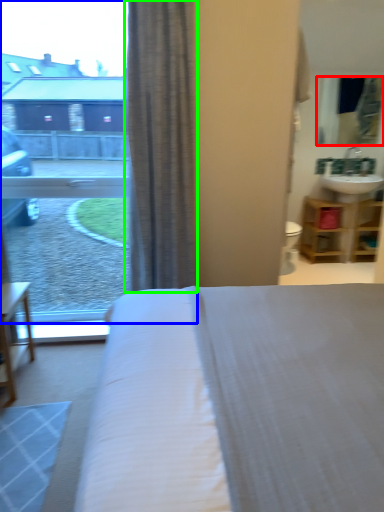
Question: Which object is positioned farthest from mirror (highlighted by a red box)? Select from window (highlighted by a blue box) and curtain (highlighted by a green box).

Choices:
 (A) window
 (B) curtain

Answer: (A)